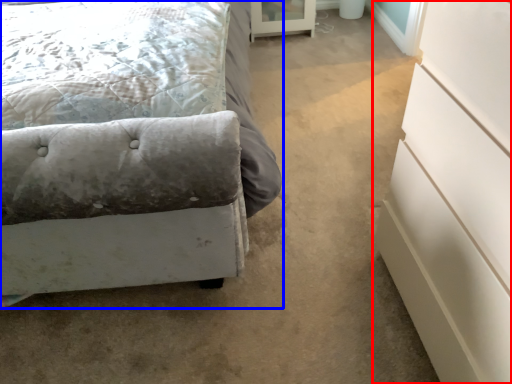
Question: Among these objects, which one is farthest to the camera, chest of drawers (highlighted by a red box) or bed (highlighted by a blue box)?

Choices:
 (A) chest of drawers
 (B) bed

Answer: (B)